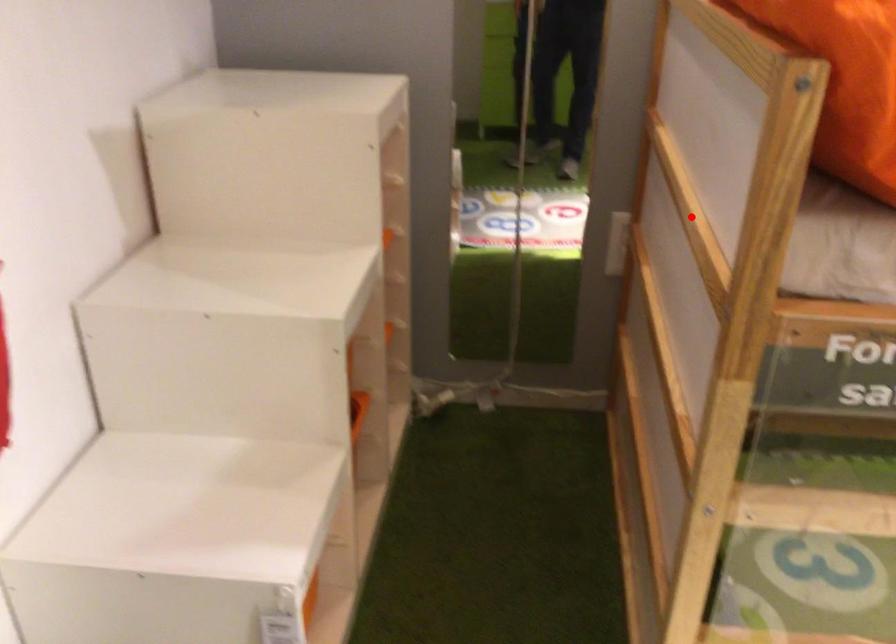
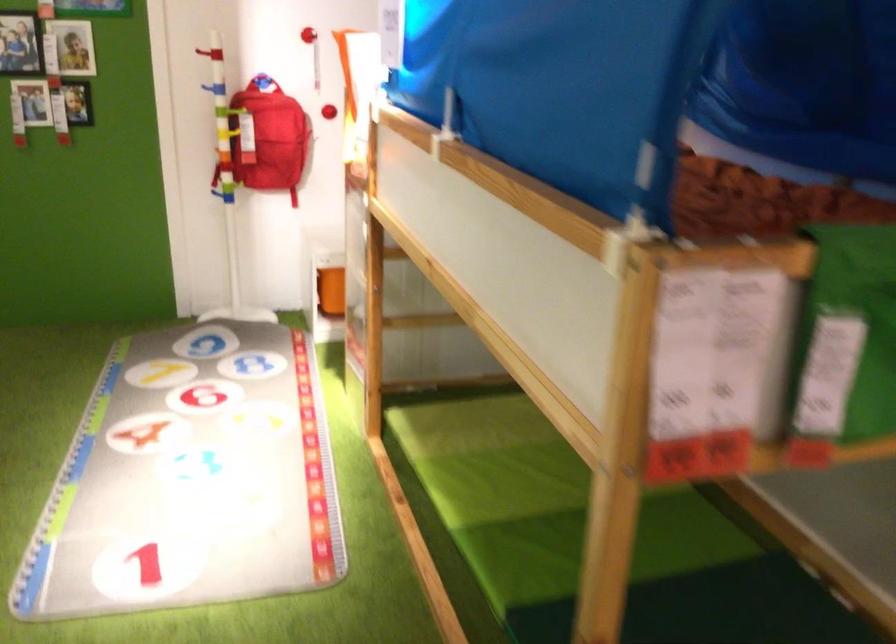
Question: I am providing you with two images of the same scene from different viewpoints. A red point is marked on the first image. Can you still see the location of the red point in image 2?

Choices:
 (A) Yes
 (B) No

Answer: (B)